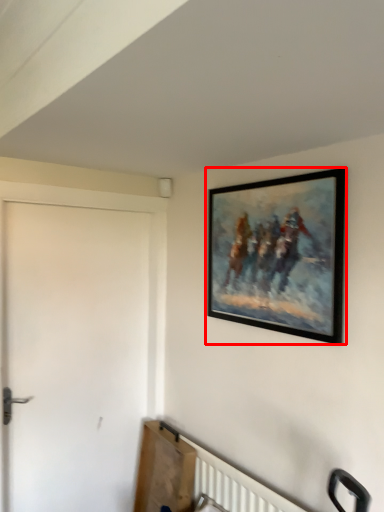
Question: From the image's perspective, where is picture frame (annotated by the red box) located relative to door?

Choices:
 (A) below
 (B) above

Answer: (B)